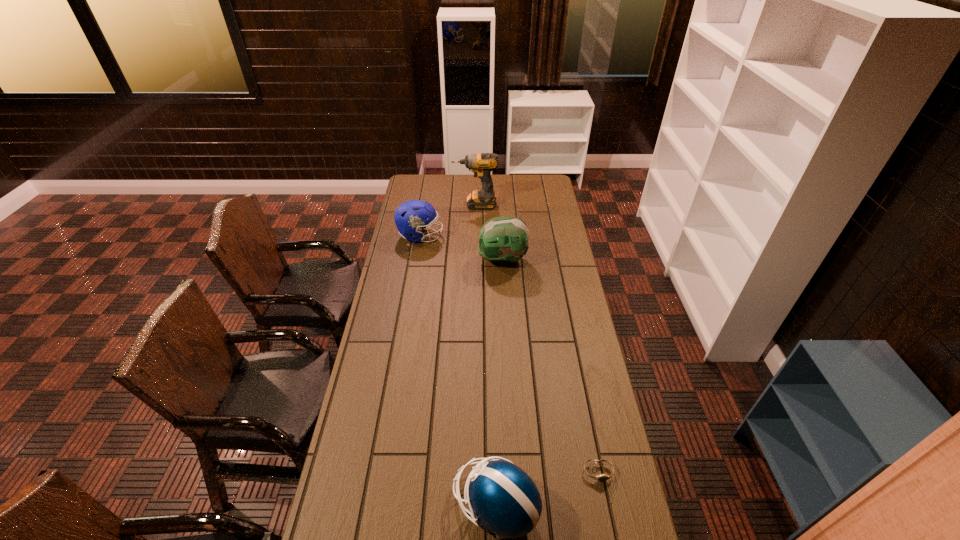
At what (x,y) coordinates should I click in order to perform the action: click on the farthest object. Please return your answer as a coordinate pair (x, y). Looking at the image, I should click on (481, 164).

Identify the location of drill. click(481, 164).

At what (x,y) coordinates should I click in order to perform the action: click on the second farthest football helmet. Please return your answer as a coordinate pair (x, y). This screenshot has width=960, height=540. Looking at the image, I should click on (504, 239).

Find the location of a particular element. The width and height of the screenshot is (960, 540). the farthest football helmet is located at coordinates (413, 216).

The image size is (960, 540). In order to click on the second farthest object in this screenshot , I will do `click(413, 216)`.

You are a GUI agent. You are given a task and a screenshot of the screen. Output one action in this format:
    pyautogui.click(x=<x>, y=<y>)
    Task: Click on the watch
    Image resolution: width=960 pixels, height=540 pixels.
    Given the screenshot: What is the action you would take?
    pyautogui.click(x=603, y=477)

The height and width of the screenshot is (540, 960). Find the location of `the shortest object`. the shortest object is located at coordinates (603, 477).

This screenshot has width=960, height=540. I want to click on vacant space located 0.230m with the drill bit of the tallest object facing forward, so click(412, 205).

Where is `vacant point located 0.100m with the drill bit of the tallest object facing forward`? The image size is (960, 540). vacant point located 0.100m with the drill bit of the tallest object facing forward is located at coordinates (435, 205).

In order to click on vacant space situated with the drill bit of the tallest object facing forward in this screenshot , I will do `click(422, 205)`.